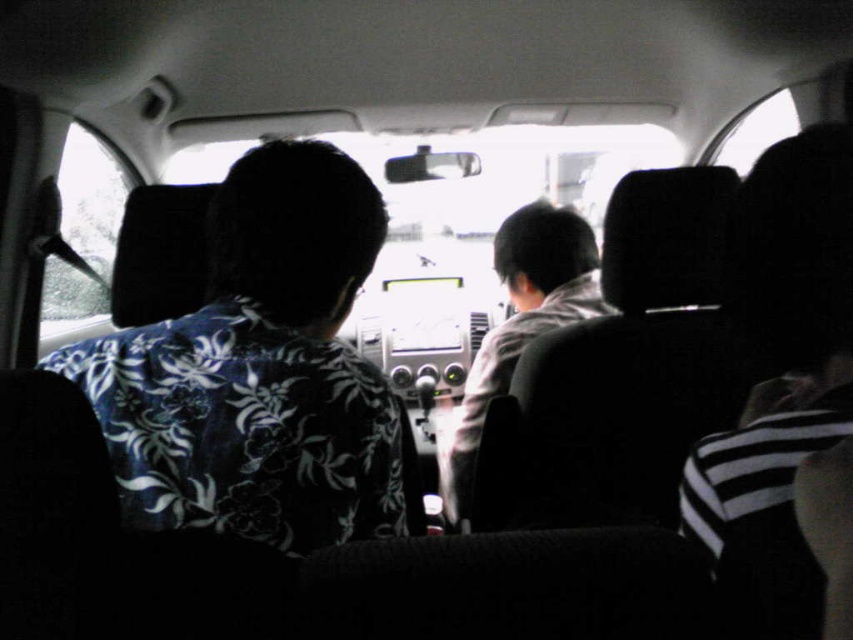
You are sitting in the backseat of the car and want to reach a button located at point (315, 540). There is an obstacle at point (479, 435). Can you reach the button without moving the obstacle?

Point (315, 540) is in front of point (479, 435), so you can reach the button without moving the obstacle because the obstacle is behind the button.